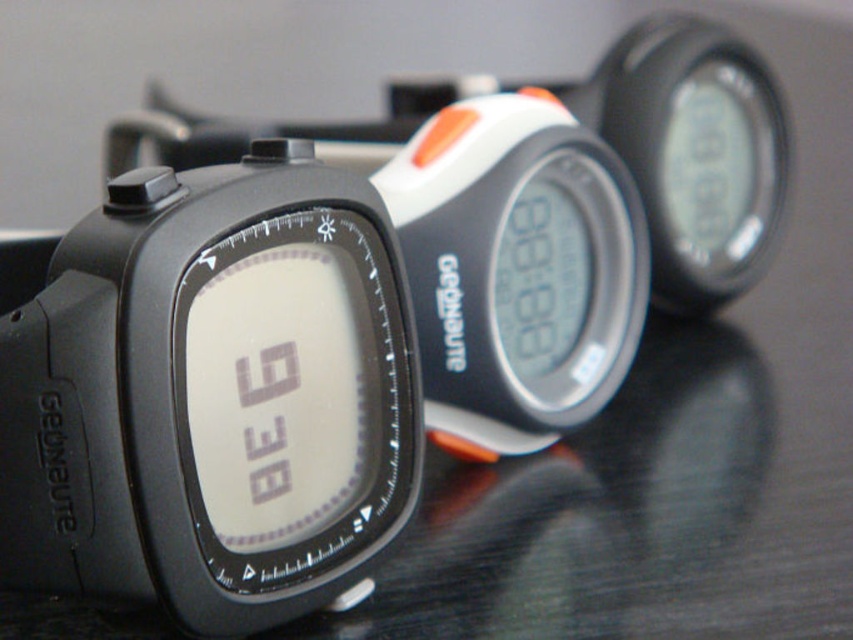
Does point (49, 355) come closer to viewer compared to point (598, 141)?

Yes.

Between point (403, 284) and point (547, 304), which one is positioned behind?

Point (547, 304)

The height and width of the screenshot is (640, 853). Identify the location of black matte watch at center. (213, 396).